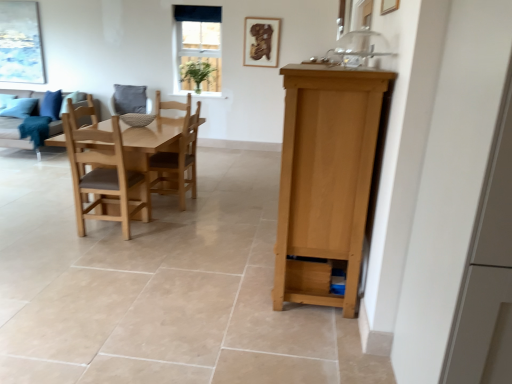
What do you see at coordinates (178, 163) in the screenshot? The height and width of the screenshot is (384, 512). I see `light brown wooden chair at center, arranged as the first chair when viewed from the back` at bounding box center [178, 163].

Locate an element on the screen. This screenshot has height=384, width=512. gray fabric armchair at center is located at coordinates (129, 99).

The width and height of the screenshot is (512, 384). Find the location of `light brown wooden chair at center, the 1th chair positioned from the front`. light brown wooden chair at center, the 1th chair positioned from the front is located at coordinates (103, 172).

Describe the element at coordinates (150, 141) in the screenshot. The height and width of the screenshot is (384, 512). I see `light brown wooden table at center` at that location.

What is the approximate height of light brown wooden table at center?

The height of light brown wooden table at center is 30.21 inches.

Where is `light brown wooden chair at center, arranged as the first chair when viewed from the back`? The image size is (512, 384). light brown wooden chair at center, arranged as the first chair when viewed from the back is located at coordinates (178, 163).

Is light brown wooden chair at center, arranged as the first chair when viewed from the back, inside matte blue painting at upper left, placed as the 2th picture frame when sorted from right to left?

No, matte blue painting at upper left, placed as the 2th picture frame when sorted from right to left, does not contain light brown wooden chair at center, arranged as the first chair when viewed from the back.

Which of these two, matte blue painting at upper left, marked as the 1th picture frame in a back-to-front arrangement, or light brown wooden chair at center, arranged as the first chair when viewed from the back, is bigger?

light brown wooden chair at center, arranged as the first chair when viewed from the back, is bigger.

Is matte blue painting at upper left, marked as the 1th picture frame in a back-to-front arrangement, oriented towards light brown wooden chair at center, acting as the 2th chair starting from the front?

No, matte blue painting at upper left, marked as the 1th picture frame in a back-to-front arrangement, is not oriented towards light brown wooden chair at center, acting as the 2th chair starting from the front.

Locate an element on the screen. The height and width of the screenshot is (384, 512). the 1st chair in front of the matte blue painting at upper left, which is the 1th picture frame from left to right, counting from the anchor's position is located at coordinates (178, 163).

Between light brown wooden chair at center, acting as the 2th chair starting from the front, and light brown wood cabinet at right, which one appears on the right side from the viewer's perspective?

From the viewer's perspective, light brown wood cabinet at right appears more on the right side.

In the image, there is a light brown wooden chair at center, acting as the 2th chair starting from the front. Identify the location of cabinetry below it (from the image's perspective). This screenshot has width=512, height=384. (325, 180).

Is light brown wooden chair at center, arranged as the first chair when viewed from the back, facing away from light brown wood cabinet at right?

No, light brown wood cabinet at right is not at the back of light brown wooden chair at center, arranged as the first chair when viewed from the back.

Can light brown wood cabinet at right be found inside light brown wooden chair at center, acting as the 2th chair starting from the front?

No, light brown wooden chair at center, acting as the 2th chair starting from the front, does not contain light brown wood cabinet at right.

In the scene shown: Could you tell me if light brown wooden table at center is facing light brown wooden chair at center, acting as the 2th chair starting from the front?

Yes, light brown wooden table at center is facing light brown wooden chair at center, acting as the 2th chair starting from the front.

Considering the relative positions of light brown wooden table at center and light brown wooden chair at center, acting as the 2th chair starting from the front, in the image provided, is light brown wooden table at center to the left of light brown wooden chair at center, acting as the 2th chair starting from the front, from the viewer's perspective?

Correct, you'll find light brown wooden table at center to the left of light brown wooden chair at center, acting as the 2th chair starting from the front.

Which of these two, light brown wooden table at center or light brown wooden chair at center, acting as the 2th chair starting from the front, is bigger?

Bigger between the two is light brown wooden table at center.

You are a GUI agent. You are given a task and a screenshot of the screen. Output one action in this format:
    pyautogui.click(x=<x>, y=<y>)
    Task: Click on the table in front of the light brown wooden chair at center, arranged as the first chair when viewed from the back
    This screenshot has width=512, height=384.
    Given the screenshot: What is the action you would take?
    pyautogui.click(x=150, y=141)

Does matte gray fabric couch at left have a lesser width compared to light brown wooden chair at center, the second chair positioned from the back?

In fact, matte gray fabric couch at left might be wider than light brown wooden chair at center, the second chair positioned from the back.

From a real-world perspective, which is physically below, matte gray fabric couch at left or light brown wooden chair at center, the 1th chair positioned from the front?

matte gray fabric couch at left, from a real-world perspective.

This screenshot has width=512, height=384. I want to click on chair that is the 1st object above the matte gray fabric couch at left (from a real-world perspective), so click(x=103, y=172).

Between matte gray fabric couch at left and light brown wooden chair at center, the second chair positioned from the back, which one has larger size?

With larger size is matte gray fabric couch at left.

From the picture: Is gray fabric armchair at center positioned behind matte blue painting at upper left, placed as the 2th picture frame when sorted from right to left?

No, it is in front of matte blue painting at upper left, placed as the 2th picture frame when sorted from right to left.

Based on their positions, is gray fabric armchair at center located to the left or right of matte blue painting at upper left, the 2th picture frame viewed from the front?

gray fabric armchair at center is to the right of matte blue painting at upper left, the 2th picture frame viewed from the front.

Does gray fabric armchair at center turn towards matte blue painting at upper left, marked as the 1th picture frame in a back-to-front arrangement?

No, gray fabric armchair at center does not turn towards matte blue painting at upper left, marked as the 1th picture frame in a back-to-front arrangement.

Where is `cabinetry in front of the light brown wooden chair at center, arranged as the first chair when viewed from the back`? The image size is (512, 384). cabinetry in front of the light brown wooden chair at center, arranged as the first chair when viewed from the back is located at coordinates (325, 180).

From a real-world perspective, is light brown wood cabinet at right on top of light brown wooden chair at center, arranged as the first chair when viewed from the back?

Indeed, from a real-world perspective, light brown wood cabinet at right stands above light brown wooden chair at center, arranged as the first chair when viewed from the back.

Between light brown wood cabinet at right and light brown wooden chair at center, arranged as the first chair when viewed from the back, which one appears on the left side from the viewer's perspective?

light brown wooden chair at center, arranged as the first chair when viewed from the back.

Who is taller, blue fabric pillow at left or matte blue painting at upper left, the 2th picture frame viewed from the front?

Standing taller between the two is matte blue painting at upper left, the 2th picture frame viewed from the front.

Considering the positions of objects blue fabric pillow at left and matte blue painting at upper left, placed as the 2th picture frame when sorted from right to left, in the image provided, who is more to the left, blue fabric pillow at left or matte blue painting at upper left, placed as the 2th picture frame when sorted from right to left,?

Positioned to the left is matte blue painting at upper left, placed as the 2th picture frame when sorted from right to left.

In the image, there is a matte blue painting at upper left, marked as the 1th picture frame in a back-to-front arrangement. Where is `pillow below it (from the image's perspective)`? The width and height of the screenshot is (512, 384). pillow below it (from the image's perspective) is located at coordinates (51, 104).

In the scene shown: From a real-world perspective, between blue fabric pillow at left and matte blue painting at upper left, marked as the 1th picture frame in a back-to-front arrangement, who is vertically lower?

From a 3D spatial view, blue fabric pillow at left is below.

Identify the location of picture frame located on the left of light brown wooden chair at center, acting as the 2th chair starting from the front. (20, 43).

Where is `cabinetry located below the light brown wooden chair at center, arranged as the first chair when viewed from the back (from the image's perspective)`? This screenshot has width=512, height=384. cabinetry located below the light brown wooden chair at center, arranged as the first chair when viewed from the back (from the image's perspective) is located at coordinates (325, 180).

Which object lies further to the anchor point matte blue painting at upper left, which is the 1th picture frame from left to right, light brown wooden chair at center, the 1th chair positioned from the front, or gray fabric armchair at center?

light brown wooden chair at center, the 1th chair positioned from the front, lies further to matte blue painting at upper left, which is the 1th picture frame from left to right, than the other object.

Based on their spatial positions, is wooden picture frame at upper center, placed as the 1th picture frame when sorted from front to back, or gray fabric armchair at center closer to white glass window at upper center?

The object closer to white glass window at upper center is wooden picture frame at upper center, placed as the 1th picture frame when sorted from front to back.

Estimate the real-world distances between objects in this image. Which object is further from white glass window at upper center, light brown wooden table at center or wooden picture frame at upper center, the second picture frame positioned from the left?

Based on the image, light brown wooden table at center appears to be further to white glass window at upper center.

Based on the photo, based on their spatial positions, is matte blue painting at upper left, marked as the 1th picture frame in a back-to-front arrangement, or matte gray fabric couch at left closer to blue fabric pillow at left?

Among the two, matte gray fabric couch at left is located nearer to blue fabric pillow at left.

Looking at the image, which one is located closer to light brown wooden chair at center, arranged as the first chair when viewed from the back, blue fabric pillow at left or light brown wood cabinet at right?

Based on the image, light brown wood cabinet at right appears to be nearer to light brown wooden chair at center, arranged as the first chair when viewed from the back.

From the image, which object appears to be farther from light brown wooden table at center, wooden drawer at lower center or blue fabric pillow at left?

Based on the image, blue fabric pillow at left appears to be further to light brown wooden table at center.

Based on their spatial positions, is gray fabric armchair at center or light brown wooden chair at center, the 1th chair positioned from the front, further from white glass window at upper center?

light brown wooden chair at center, the 1th chair positioned from the front, is further to white glass window at upper center.

Consider the image. Based on their spatial positions, is light brown wooden chair at center, arranged as the first chair when viewed from the back, or light brown wooden table at center closer to light brown wood cabinet at right?

light brown wooden table at center lies closer to light brown wood cabinet at right than the other object.

Locate an element on the screen. The image size is (512, 384). table located between light brown wooden chair at center, the second chair positioned from the back, and wooden drawer at lower center in the left-right direction is located at coordinates (150, 141).

This screenshot has width=512, height=384. I want to click on chair located between light brown wooden table at center and blue fabric pillow at left in the depth direction, so click(x=178, y=163).

This screenshot has height=384, width=512. I want to click on window between gray fabric armchair at center and wooden picture frame at upper center, the 2th picture frame when ordered from back to front, so click(x=199, y=47).

Locate an element on the screen. table between wooden drawer at lower center and gray fabric armchair at center from front to back is located at coordinates (150, 141).